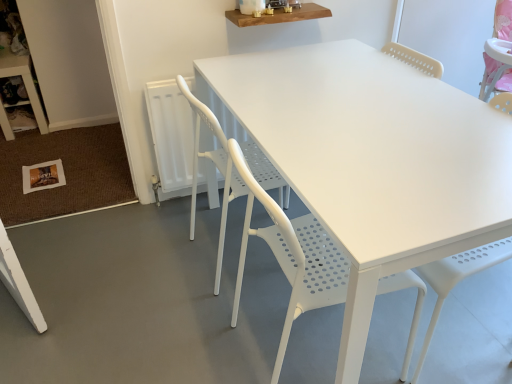
Question: Is wooden shelf at upper center, placed as the 1th table when sorted from front to back, at the left side of white plastic table at lower left, positioned as the second table in right-to-left order?

Choices:
 (A) yes
 (B) no

Answer: (B)

Question: Does wooden shelf at upper center, which is counted as the second table, starting from the left, have a greater width compared to white plastic table at lower left, which appears as the 1th table when viewed from the back?

Choices:
 (A) no
 (B) yes

Answer: (A)

Question: Considering the relative sizes of wooden shelf at upper center, which appears as the first table when viewed from the right, and white plastic table at lower left, positioned as the second table in right-to-left order, in the image provided, is wooden shelf at upper center, which appears as the first table when viewed from the right, smaller than white plastic table at lower left, positioned as the second table in right-to-left order,?

Choices:
 (A) yes
 (B) no

Answer: (A)

Question: Could you tell me if wooden shelf at upper center, which is counted as the second table, starting from the left, is facing white plastic table at lower left, positioned as the second table in front-to-back order?

Choices:
 (A) no
 (B) yes

Answer: (A)

Question: From a real-world perspective, is wooden shelf at upper center, placed as the 1th table when sorted from front to back, on white plastic table at lower left, positioned as the second table in front-to-back order?

Choices:
 (A) yes
 (B) no

Answer: (A)

Question: Visually, is wooden shelf at upper center, which appears as the first table when viewed from the right, positioned to the left or to the right of white perforated plastic chair at center, marked as the second chair in a front-to-back arrangement?

Choices:
 (A) left
 (B) right

Answer: (B)

Question: In terms of width, does wooden shelf at upper center, which appears as the first table when viewed from the right, look wider or thinner when compared to white perforated plastic chair at center, marked as the second chair in a front-to-back arrangement?

Choices:
 (A) thin
 (B) wide

Answer: (A)

Question: Considering the positions of point (268, 14) and point (195, 200), is point (268, 14) closer or farther from the camera than point (195, 200)?

Choices:
 (A) farther
 (B) closer

Answer: (B)

Question: From the image's perspective, is wooden shelf at upper center, arranged as the second table when viewed from the back, located above or below white perforated plastic chair at center, the first chair viewed from the back?

Choices:
 (A) below
 (B) above

Answer: (B)

Question: Is white perforated plastic chair at center, which is the 2th chair from back to front, in front of or behind wooden shelf at upper center, which appears as the first table when viewed from the right, in the image?

Choices:
 (A) behind
 (B) front

Answer: (B)

Question: From the image's perspective, is white perforated plastic chair at center, which is the 2th chair from back to front, positioned above or below wooden shelf at upper center, which appears as the first table when viewed from the right?

Choices:
 (A) below
 (B) above

Answer: (A)

Question: From their relative heights in the image, would you say white perforated plastic chair at center, which is the 2th chair from back to front, is taller or shorter than wooden shelf at upper center, placed as the 1th table when sorted from front to back?

Choices:
 (A) tall
 (B) short

Answer: (A)

Question: Is white perforated plastic chair at center, arranged as the first chair when viewed from the front, inside or outside of wooden shelf at upper center, arranged as the second table when viewed from the back?

Choices:
 (A) inside
 (B) outside

Answer: (B)

Question: Does point (236, 23) appear closer or farther from the camera than point (188, 94)?

Choices:
 (A) closer
 (B) farther

Answer: (B)

Question: Relative to white perforated plastic chair at center, which is the 2th chair from back to front, is wooden shelf at upper center, which is counted as the second table, starting from the left, in front or behind?

Choices:
 (A) behind
 (B) front

Answer: (A)